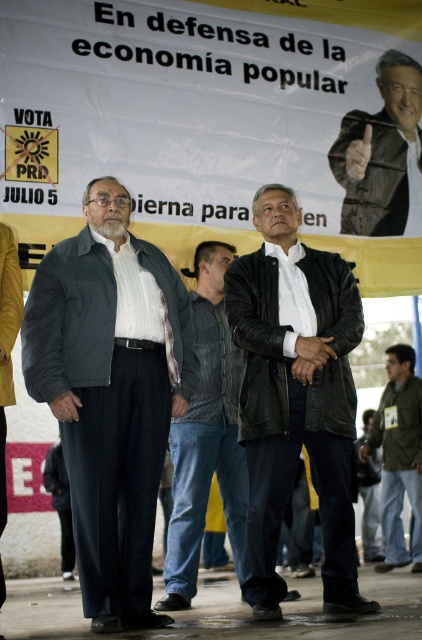
Which is below, dark gray jacket at center or black leather jacket at center?

black leather jacket at center is below.

Is point (178, 330) in front of point (264, 476)?

No, (178, 330) is further to viewer.

The height and width of the screenshot is (640, 422). In order to click on dark gray jacket at center in this screenshot , I will do `click(110, 394)`.

At what (x,y) coordinates should I click in order to perform the action: click on dark gray jacket at center. Please return your answer as a coordinate pair (x, y). This screenshot has width=422, height=640. Looking at the image, I should click on (110, 394).

Is black leather jacket at center positioned at the back of leather jacket at center?

No, it is in front of leather jacket at center.

Is point (254, 570) behind point (238, 360)?

That is False.

Where is `black leather jacket at center`? This screenshot has height=640, width=422. black leather jacket at center is located at coordinates (294, 396).

Which is below, dark gray jacket at center or brown leather jacket at upper right?

dark gray jacket at center is below.

Does dark gray jacket at center lie behind brown leather jacket at upper right?

No, dark gray jacket at center is in front of brown leather jacket at upper right.

This screenshot has width=422, height=640. What are the coordinates of `dark gray jacket at center` in the screenshot? It's located at (110, 394).